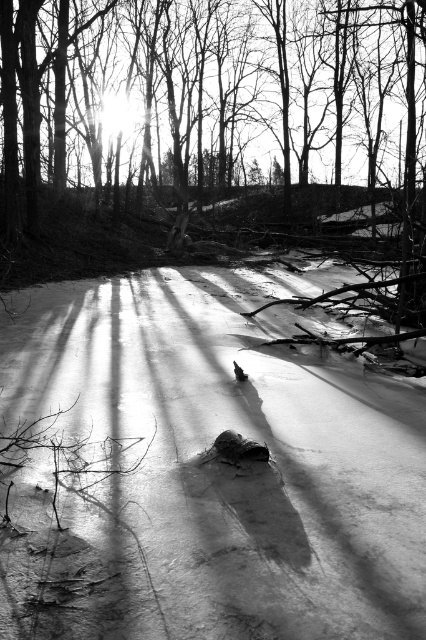
Question: Which point appears closest to the camera in this image?

Choices:
 (A) (2, 36)
 (B) (124, 502)

Answer: (B)

Question: Is the position of white matte snow at center less distant than that of silhouette bare tree at center?

Choices:
 (A) yes
 (B) no

Answer: (A)

Question: Can you confirm if white matte snow at center is wider than silhouette bare tree at center?

Choices:
 (A) yes
 (B) no

Answer: (B)

Question: Can you confirm if white matte snow at center is smaller than silhouette bare tree at center?

Choices:
 (A) no
 (B) yes

Answer: (B)